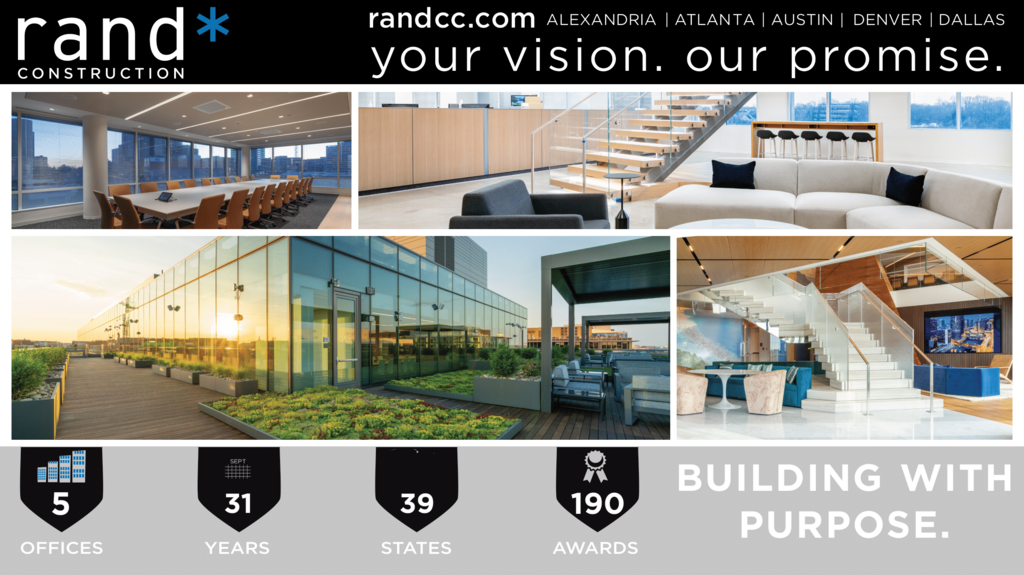
This screenshot has height=575, width=1024. In order to click on stairs in this screenshot , I will do `click(869, 363)`, `click(636, 149)`.